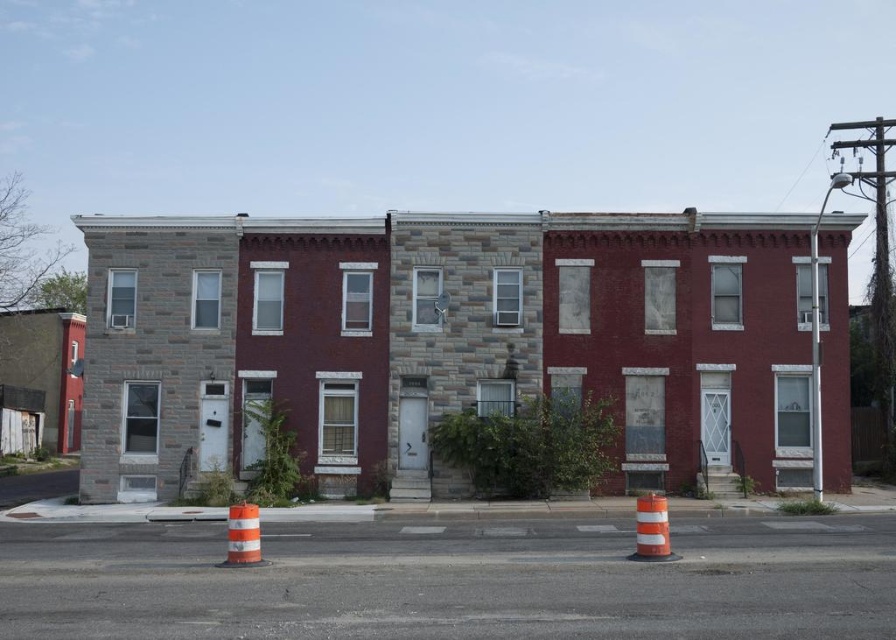
Between orange striped traffic cone at center and orange/white striped traffic cone at lower center, which one is positioned lower?

orange striped traffic cone at center is lower down.

From the picture: Is orange striped traffic cone at center above orange/white striped traffic cone at lower center?

Incorrect, orange striped traffic cone at center is not positioned above orange/white striped traffic cone at lower center.

This screenshot has width=896, height=640. Find the location of `orange striped traffic cone at center`. orange striped traffic cone at center is located at coordinates (651, 529).

The width and height of the screenshot is (896, 640). I want to click on orange striped traffic cone at center, so click(x=651, y=529).